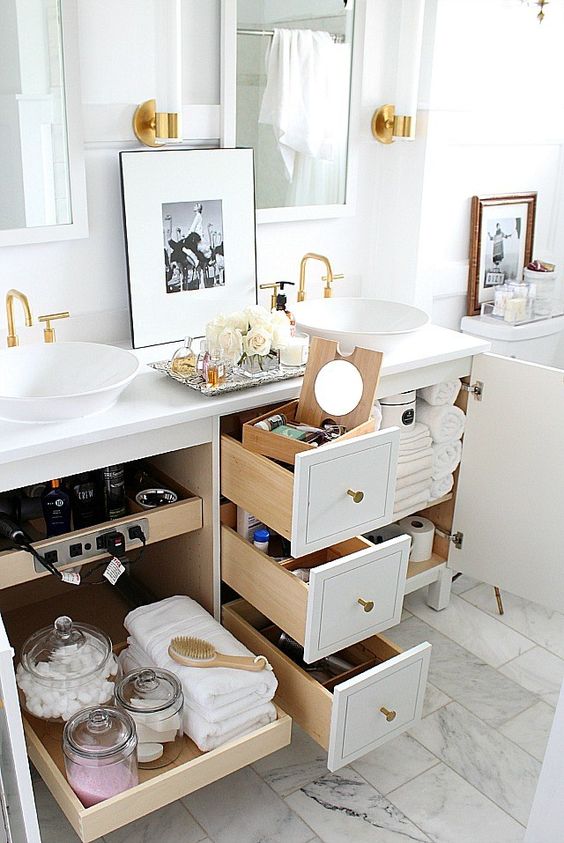
Where is `electrical outlet`? The height and width of the screenshot is (843, 564). electrical outlet is located at coordinates (51, 559), (74, 552), (99, 544), (131, 537).